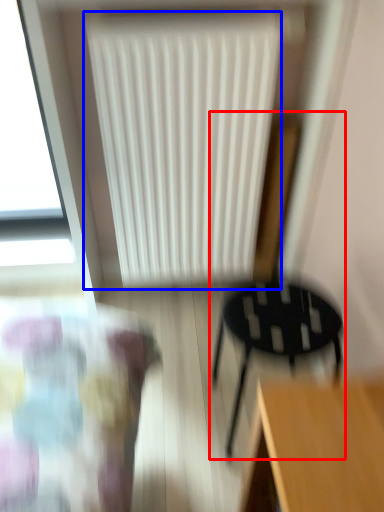
Question: Which object is closer to the camera taking this photo, chair (highlighted by a red box) or radiator (highlighted by a blue box)?

Choices:
 (A) chair
 (B) radiator

Answer: (A)